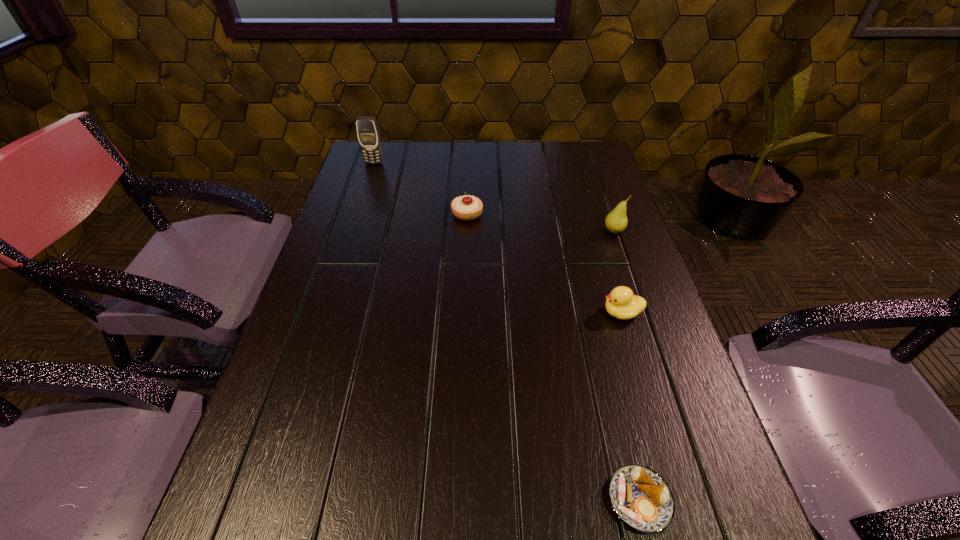
Find the location of a particular element. This screenshot has height=540, width=960. vacant space located on the front of the second tallest object is located at coordinates (658, 360).

The image size is (960, 540). I want to click on vacant space situated 0.150m on the beak of the second nearest object, so click(535, 313).

Where is `free region located on the beak of the second nearest object`? This screenshot has width=960, height=540. free region located on the beak of the second nearest object is located at coordinates (562, 313).

You are a GUI agent. You are given a task and a screenshot of the screen. Output one action in this format:
    pyautogui.click(x=<x>, y=<y>)
    Task: Click on the vacant space located 0.210m on the beak of the second nearest object
    Image resolution: width=960 pixels, height=540 pixels.
    Given the screenshot: What is the action you would take?
    pyautogui.click(x=508, y=313)

The height and width of the screenshot is (540, 960). In order to click on vacant region located 0.130m on the back of the second object from left to right in this screenshot , I will do (x=468, y=180).

Identify the location of vacant space located 0.260m on the back of the nearest object. (602, 344).

At what (x,y) coordinates should I click in order to perform the action: click on object present at the far edge. Please return your answer as a coordinate pair (x, y). This screenshot has height=540, width=960. Looking at the image, I should click on (368, 134).

Identify the location of object located in the left edge section of the desktop. (368, 134).

This screenshot has width=960, height=540. What are the coordinates of `pear that is at the right edge` in the screenshot? It's located at (616, 221).

This screenshot has height=540, width=960. I want to click on duckling at the right edge, so tap(621, 303).